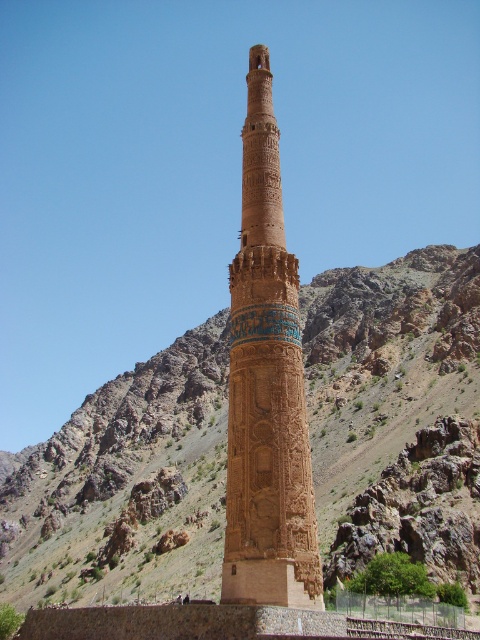
Question: Does brown rocky mountain at center come in front of brown stone minaret at center?

Choices:
 (A) yes
 (B) no

Answer: (B)

Question: Which object appears farthest from the camera in this image?

Choices:
 (A) brown rocky mountain at center
 (B) brown stone minaret at center

Answer: (A)

Question: Among these points, which one is nearest to the camera?

Choices:
 (A) pyautogui.click(x=211, y=433)
 (B) pyautogui.click(x=278, y=241)

Answer: (B)

Question: Which object appears farthest from the camera in this image?

Choices:
 (A) brown stone minaret at center
 (B) brown rocky mountain at center

Answer: (B)

Question: Is brown rocky mountain at center above brown stone minaret at center?

Choices:
 (A) yes
 (B) no

Answer: (B)

Question: Can you confirm if brown rocky mountain at center is positioned below brown stone minaret at center?

Choices:
 (A) no
 (B) yes

Answer: (B)